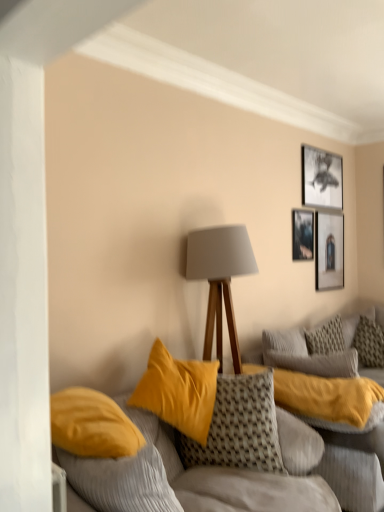
Question: Is matte black picture frame at upper right, which is the first picture frame in bottom-to-top order, looking in the opposite direction of textured woven pillow at center, acting as the 1th pillow starting from the front?

Choices:
 (A) yes
 (B) no

Answer: (B)

Question: From a real-world perspective, is matte black picture frame at upper right, which is counted as the third picture frame, starting from the top, physically above textured woven pillow at center, acting as the 1th pillow starting from the front?

Choices:
 (A) yes
 (B) no

Answer: (A)

Question: Is matte black picture frame at upper right, which is the first picture frame in bottom-to-top order, shorter than textured woven pillow at center, acting as the 2th pillow starting from the right?

Choices:
 (A) no
 (B) yes

Answer: (A)

Question: Can we say matte black picture frame at upper right, which is counted as the third picture frame, starting from the top, lies outside textured woven pillow at center, acting as the 2th pillow starting from the right?

Choices:
 (A) no
 (B) yes

Answer: (B)

Question: Does matte black picture frame at upper right, which is the first picture frame in bottom-to-top order, have a lesser width compared to textured woven pillow at center, which ranks as the 1th pillow in left-to-right order?

Choices:
 (A) yes
 (B) no

Answer: (A)

Question: From the image's perspective, is textured gray pillow at right, acting as the 1th pillow starting from the back, above or below black matte picture frame at upper right, which is counted as the 3th picture frame, starting from the bottom?

Choices:
 (A) below
 (B) above

Answer: (A)

Question: Is point (355, 336) closer or farther from the camera than point (311, 158)?

Choices:
 (A) farther
 (B) closer

Answer: (A)

Question: In the image, is textured gray pillow at right, acting as the 1th pillow starting from the back, positioned in front of or behind black matte picture frame at upper right, the first picture frame when ordered from top to bottom?

Choices:
 (A) behind
 (B) front

Answer: (B)

Question: From a real-world perspective, is textured gray pillow at right, the second pillow from the left, physically located above or below black matte picture frame at upper right, the first picture frame when ordered from top to bottom?

Choices:
 (A) below
 (B) above

Answer: (A)

Question: Choose the correct answer: Is matte gray lampshade at center inside textured woven pillow at center, acting as the 2th pillow starting from the back, or outside it?

Choices:
 (A) outside
 (B) inside

Answer: (A)

Question: From the image's perspective, is matte gray lampshade at center above or below textured woven pillow at center, acting as the 2th pillow starting from the right?

Choices:
 (A) above
 (B) below

Answer: (A)

Question: In terms of height, does matte gray lampshade at center look taller or shorter compared to textured woven pillow at center, acting as the 2th pillow starting from the back?

Choices:
 (A) short
 (B) tall

Answer: (B)

Question: Does point (205, 357) appear closer or farther from the camera than point (288, 402)?

Choices:
 (A) closer
 (B) farther

Answer: (B)

Question: Which is correct: matte black picture frame at upper right, which is counted as the third picture frame, starting from the top, is inside textured woven pillow at center, which ranks as the 1th pillow in left-to-right order, or outside of it?

Choices:
 (A) inside
 (B) outside

Answer: (B)

Question: Is point (322, 266) positioned closer to the camera than point (296, 386)?

Choices:
 (A) closer
 (B) farther

Answer: (B)